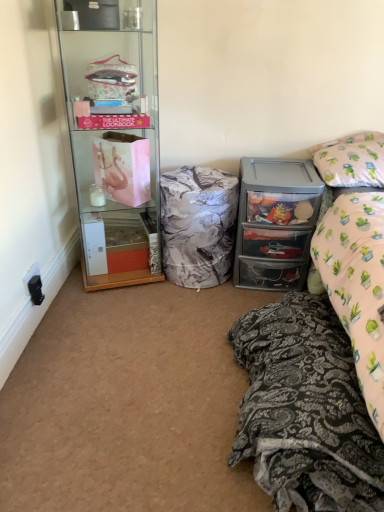
Where is `vacant area to the left of patterned fabric bed at lower right`? vacant area to the left of patterned fabric bed at lower right is located at coordinates (139, 403).